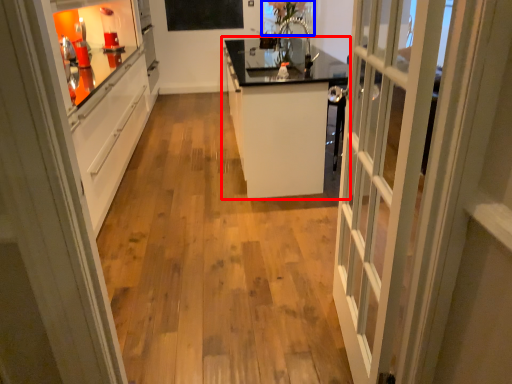
Question: Which of the following is the closest to the observer, cabinetry (highlighted by a red box) or window screen (highlighted by a blue box)?

Choices:
 (A) cabinetry
 (B) window screen

Answer: (A)